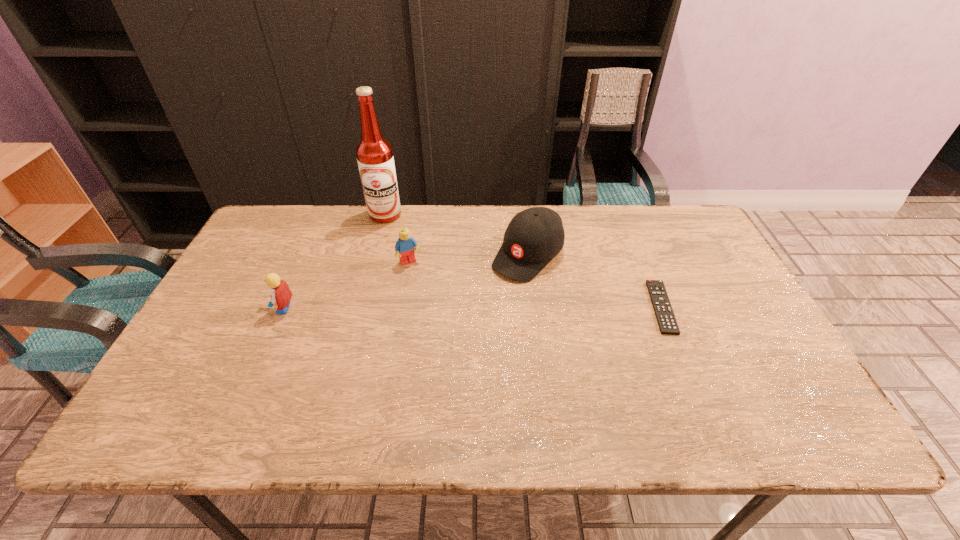
What are the coordinates of `free space on the desktop that is between the nearer Lego and the shortest object and is positioned with a logo on the front of the second object from right to left` in the screenshot? It's located at (476, 308).

Locate an element on the screen. This screenshot has width=960, height=540. vacant space on the desktop that is between the leftmost object and the shortest object and is positioned on the label side of the tallest object is located at coordinates (421, 308).

What are the coordinates of `vacant spot on the desktop that is between the nearer Lego and the rightmost object and is positioned on the face of the right Lego` in the screenshot? It's located at (435, 308).